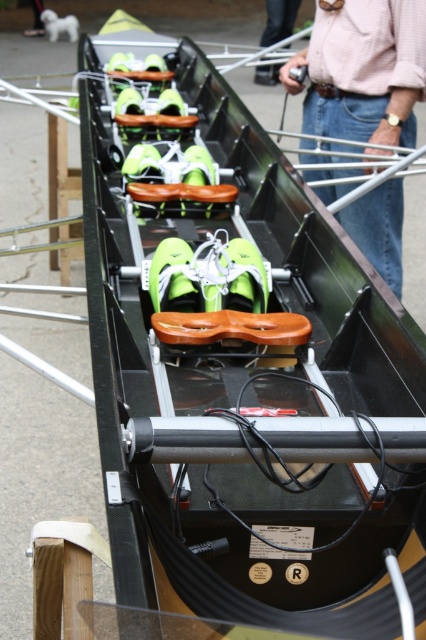
Question: Does pink shirt at upper center appear on the left side of pink fabric shirt at upper center?

Choices:
 (A) yes
 (B) no

Answer: (A)

Question: Is pink shirt at upper center thinner than pink fabric shirt at upper center?

Choices:
 (A) yes
 (B) no

Answer: (B)

Question: Which point is closer to the camera?

Choices:
 (A) (276, 74)
 (B) (377, 257)

Answer: (B)

Question: Among these objects, which one is nearest to the camera?

Choices:
 (A) pink fabric shirt at upper center
 (B) pink shirt at upper center

Answer: (B)

Question: Which of the following is the farthest from the observer?

Choices:
 (A) (293, 12)
 (B) (414, 28)

Answer: (A)

Question: Is pink shirt at upper center to the left of pink fabric shirt at upper center from the viewer's perspective?

Choices:
 (A) yes
 (B) no

Answer: (A)